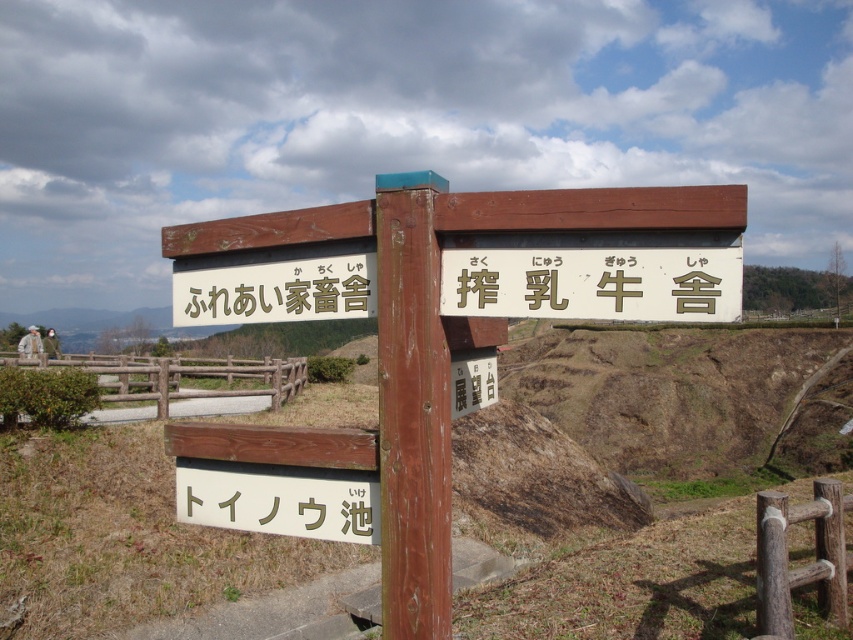
You are standing in front of two signs, the white wood sign at lower center and the brown wooden sign at center. Which one is positioned lower in the image?

The white wood sign at lower center is positioned lower than the brown wooden sign at center.

You are a visitor at a farm and see the wooden sign at center and the wooden post at center. Which one is larger in size?

The wooden sign at center is bigger than the wooden post at center.